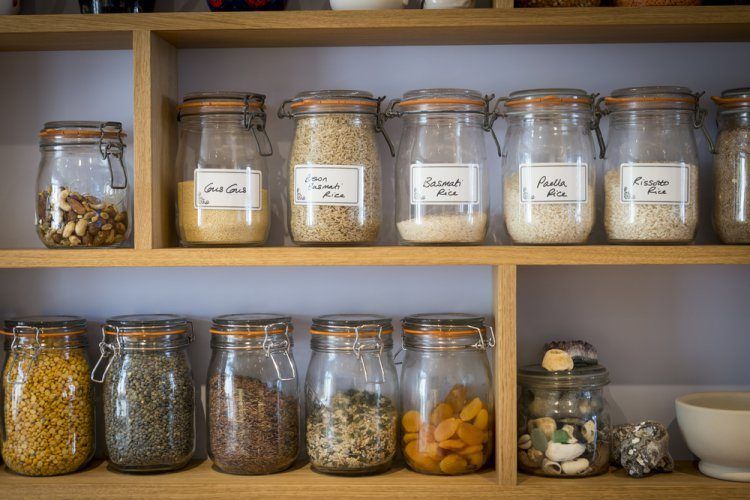
Find the location of a particular element. bowl is located at coordinates (722, 427).